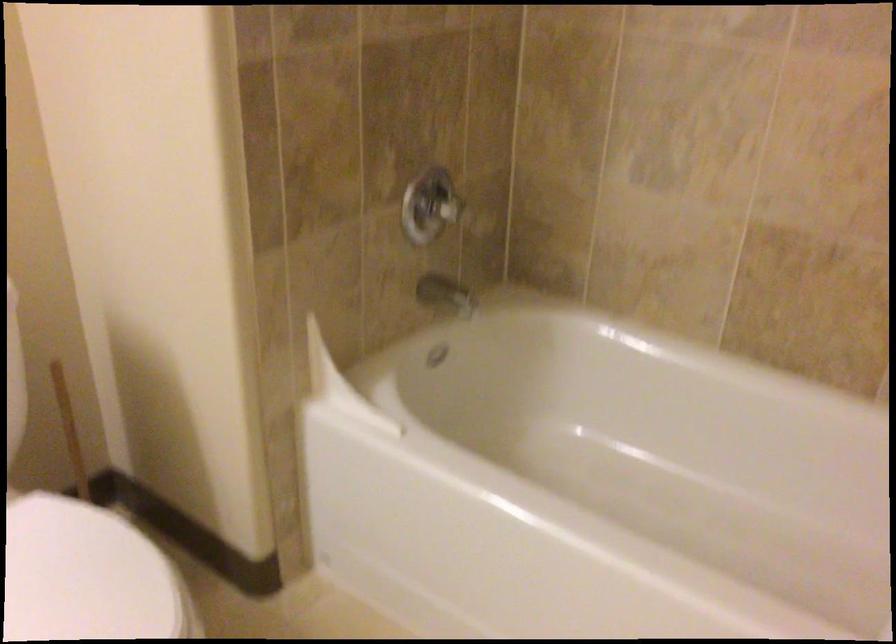
Image resolution: width=896 pixels, height=644 pixels. I want to click on toilet brush handle, so click(x=72, y=438).